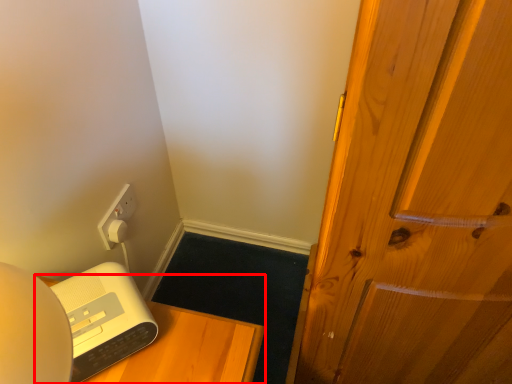
Question: In this image, where is furniture (annotated by the red box) located relative to appliance?

Choices:
 (A) right
 (B) left

Answer: (A)